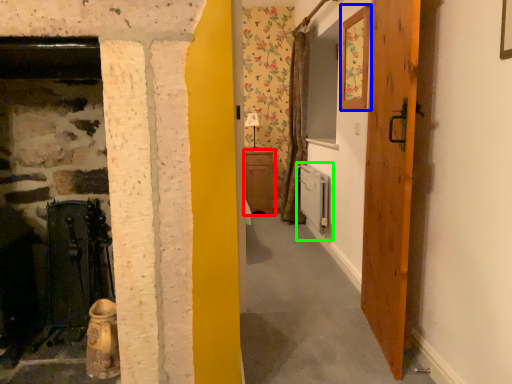
Question: Estimate the real-world distances between objects in this image. Which object is closer to cabinetry (highlighted by a red box), picture frame (highlighted by a blue box) or appliance (highlighted by a green box)?

Choices:
 (A) picture frame
 (B) appliance

Answer: (B)